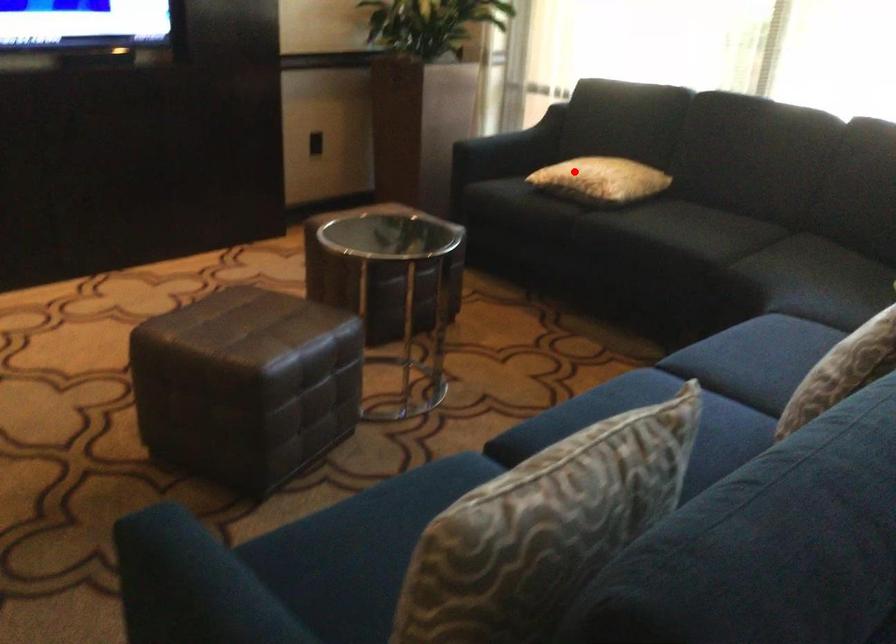
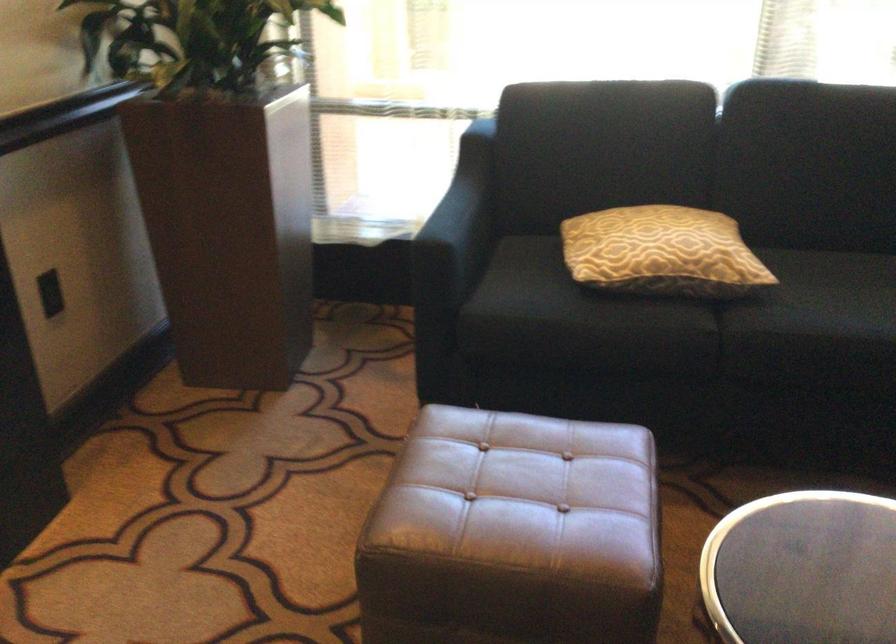
The point at the highlighted location is marked in the first image. Where is the corresponding point in the second image?

(661, 252)